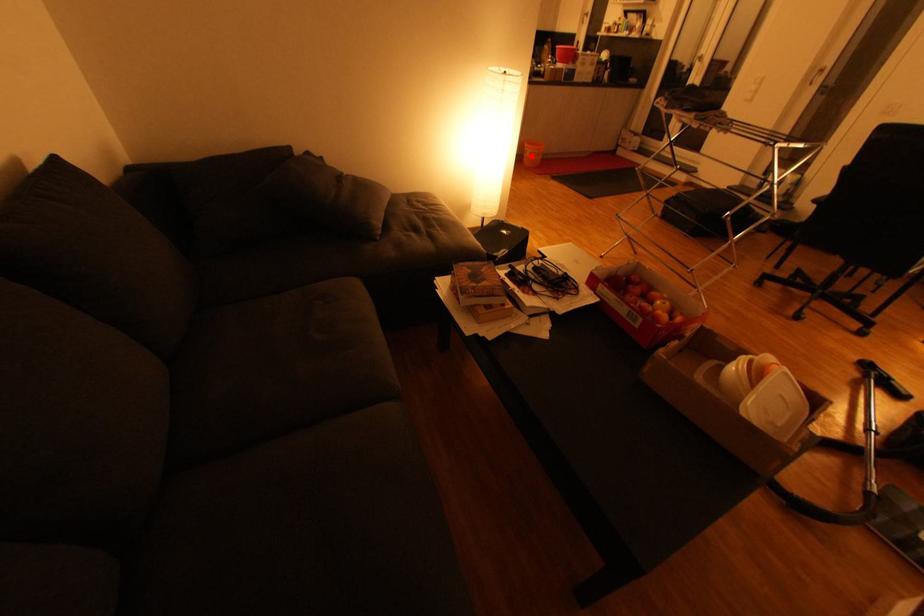
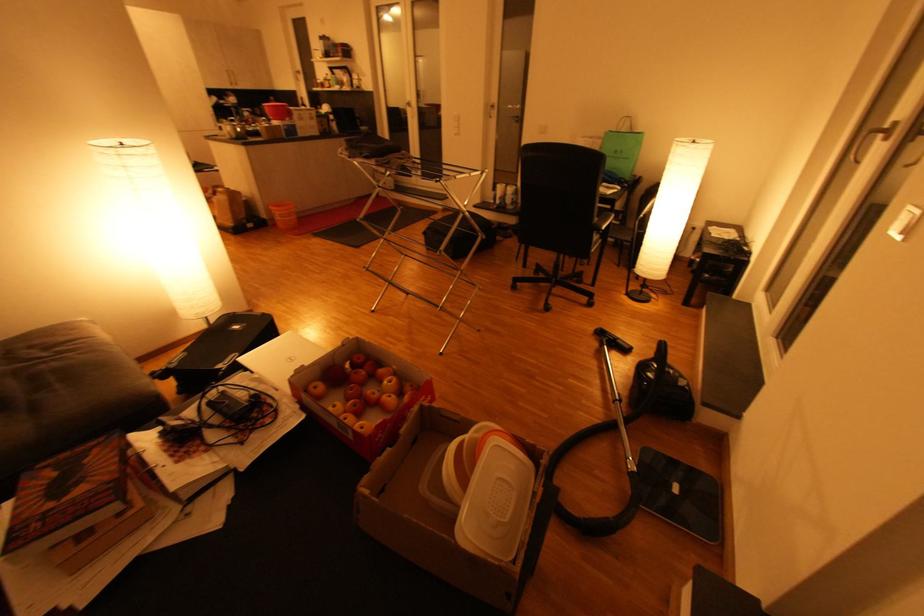
Question: I am providing you with two images of the same scene from different viewpoints. Image1 has a red point marked. In image2, the corresponding 3D location appears at what relative position? Reply with the corresponding letter.

Choices:
 (A) Closer
 (B) Farther

Answer: (B)